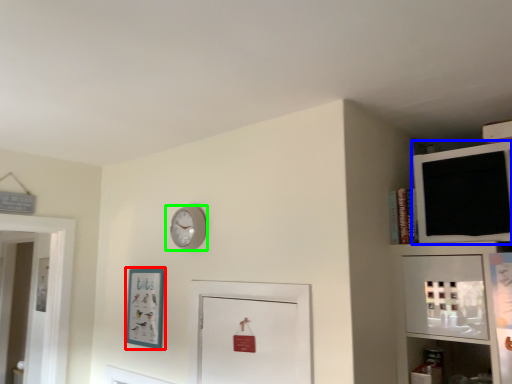
Question: Which is farther away from picture frame (highlighted by a red box)? medicine cabinet (highlighted by a blue box) or wall clock (highlighted by a green box)?

Choices:
 (A) medicine cabinet
 (B) wall clock

Answer: (A)